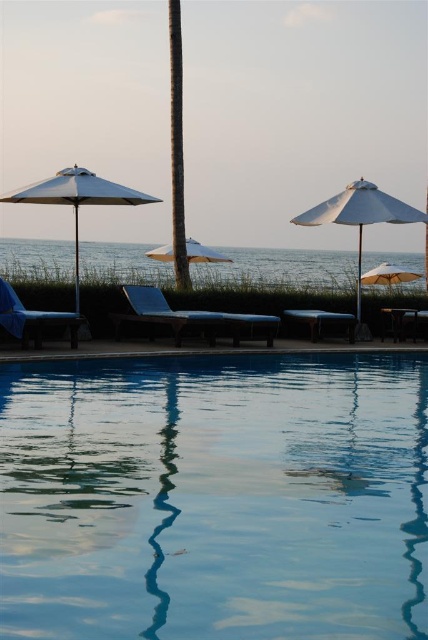
You are a lifeguard standing at the edge of the pool. You need to quickly reach either the white matte umbrella at left or the beige fabric umbrella at center to retrieve a misplaced whistle. If you can run 5 meters in 10 seconds, how long would it take you to reach the closest one?

The white matte umbrella at left is 4.01 meters away from the beige fabric umbrella at center. Since the distance between them is 4.01 meters, the closest one would depend on your starting position. However, since you are at the edge of the pool, we need to determine which umbrella is closer to the pool edge. Without specific positioning details, we can assume the umbrellas are placed around the pool. If the white matte umbrella at left is near the pool edge, it would be closer. Alternatively, if the beige.

You are standing at the edge of the pool and want to grab your towel from the matte blue beach chair at left without walking too far. Is the beige fabric umbrella at center in your way?

The matte blue beach chair at left is closer to the viewer than the beige fabric umbrella at center, so the umbrella is further away and not blocking your path to the chair.